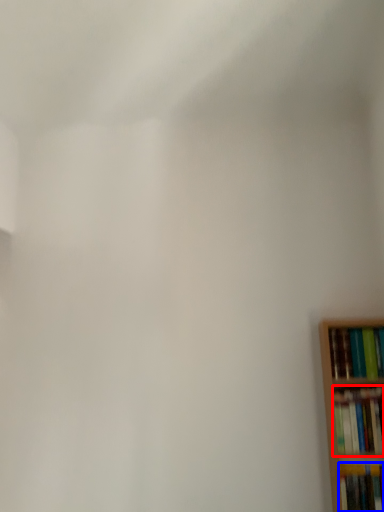
Question: Which point is further to the camera, book (highlighted by a red box) or book (highlighted by a blue box)?

Choices:
 (A) book
 (B) book

Answer: (A)